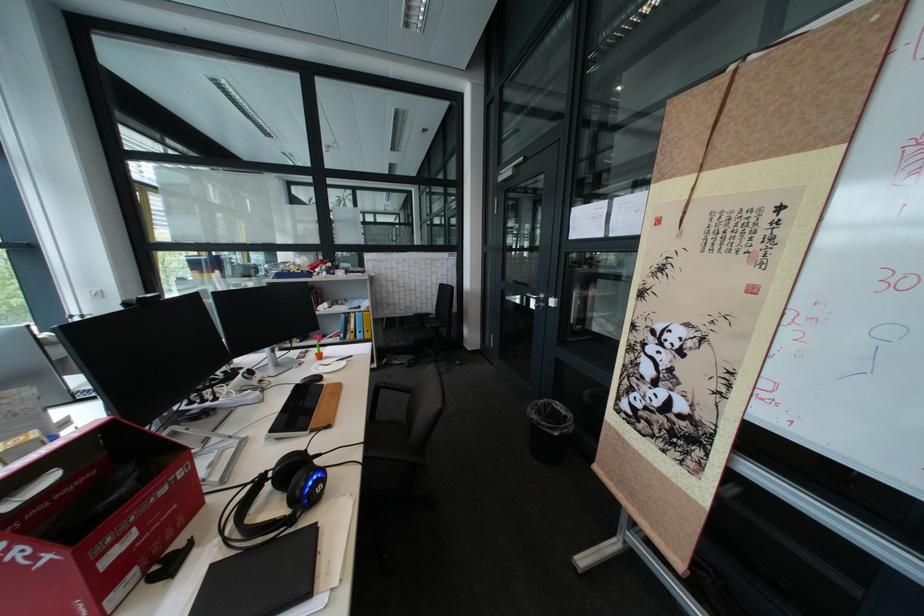
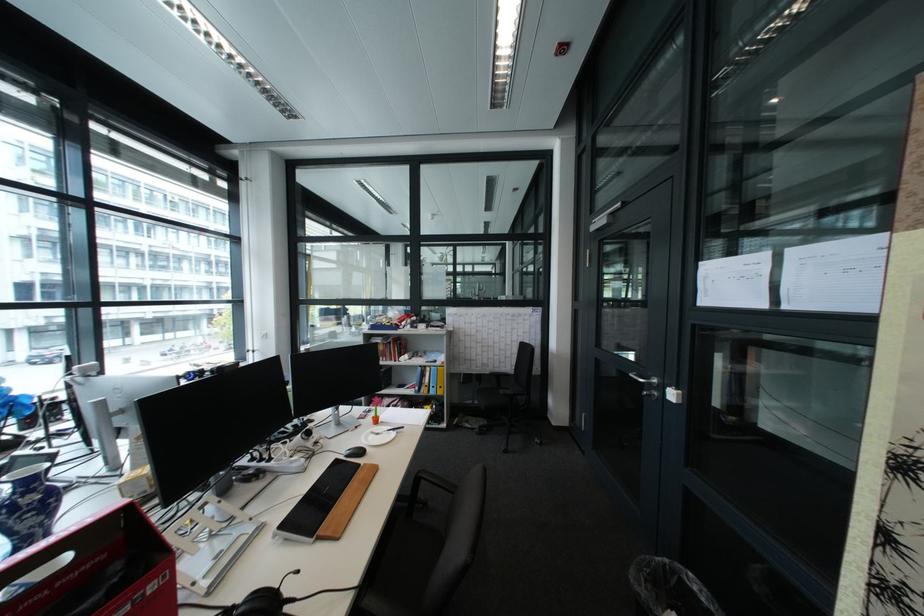
What movement of the cameraman would produce the second image?

The cameraman moved toward right, forward.